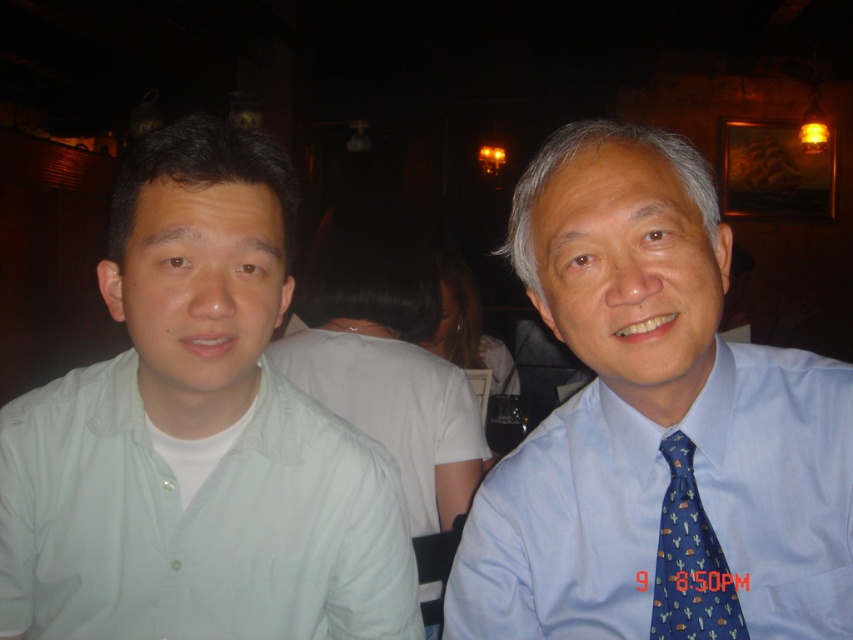
Question: Does light green cotton shirt at left appear over blue silk shirt at right?

Choices:
 (A) yes
 (B) no

Answer: (B)

Question: Is light green cotton shirt at left to the left of blue silk tie at right from the viewer's perspective?

Choices:
 (A) no
 (B) yes

Answer: (B)

Question: Which of the following is the farthest from the observer?

Choices:
 (A) blue silk shirt at right
 (B) light green cotton shirt at left

Answer: (B)

Question: Which point is closer to the camera?

Choices:
 (A) blue silk shirt at right
 (B) blue silk tie at right
 (C) light green cotton shirt at left

Answer: (A)

Question: Among these objects, which one is nearest to the camera?

Choices:
 (A) blue silk tie at right
 (B) light green cotton shirt at left
 (C) blue silk shirt at right

Answer: (C)

Question: Observing the image, what is the correct spatial positioning of light green cotton shirt at left in reference to blue silk tie at right?

Choices:
 (A) below
 (B) above

Answer: (B)